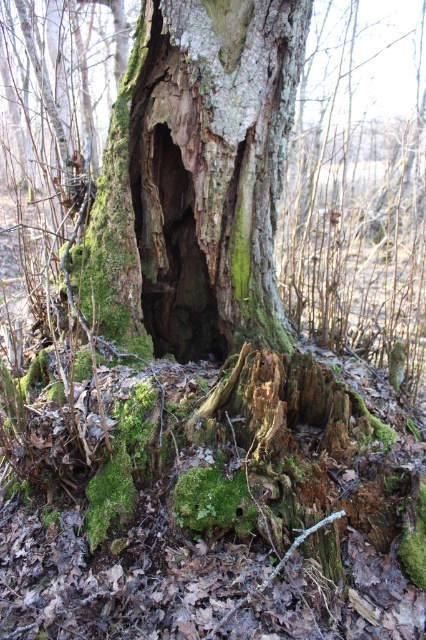
Can you confirm if green mossy bark at center is positioned below green mossy tree trunk at center?

Indeed, green mossy bark at center is positioned under green mossy tree trunk at center.

Does green mossy bark at center have a smaller size compared to green mossy tree trunk at center?

Incorrect, green mossy bark at center is not smaller in size than green mossy tree trunk at center.

What do you see at coordinates (198, 176) in the screenshot? The image size is (426, 640). I see `green mossy bark at center` at bounding box center [198, 176].

Locate an element on the screen. green mossy bark at center is located at coordinates click(198, 176).